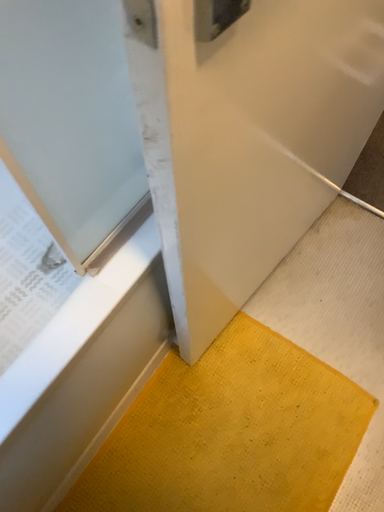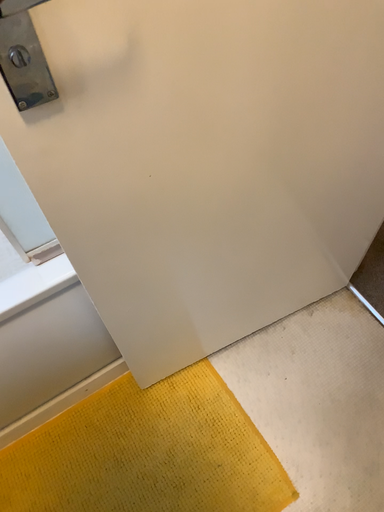
Question: How did the camera likely rotate when shooting the video?

Choices:
 (A) rotated left
 (B) rotated right

Answer: (A)